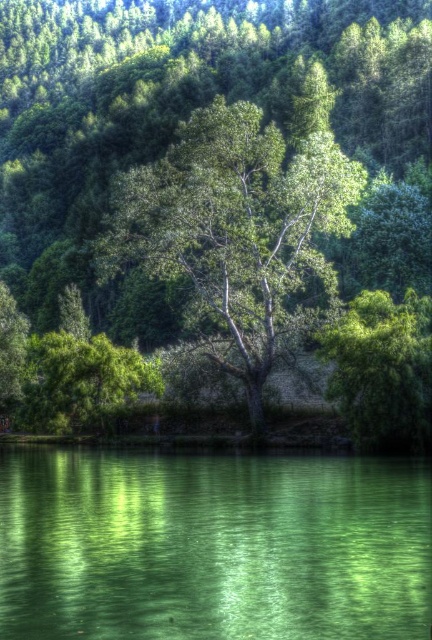
You are standing at the point with coordinates [212,547] in the serene natural landscape. What do you see at your current location?

At point [212,547], you are standing on green reflective water at center.

You are planning to take a photo of both the green leafy tree at center and the green leafy tree at right. Which tree should you focus on first if you want to capture the largest tree in the scene?

The green leafy tree at center is bigger than the green leafy tree at right, so you should focus on the green leafy tree at center first to capture the largest tree in the scene.

You are standing at the point marked by the coordinates point (212, 547). Looking around, you see the green reflective water at center. Which direction should you walk to reach the green reflective water at center?

You are already at the point marked by the coordinates point (212, 547), which is where the green reflective water at center is located. Therefore, you don not need to move in any direction to reach it.